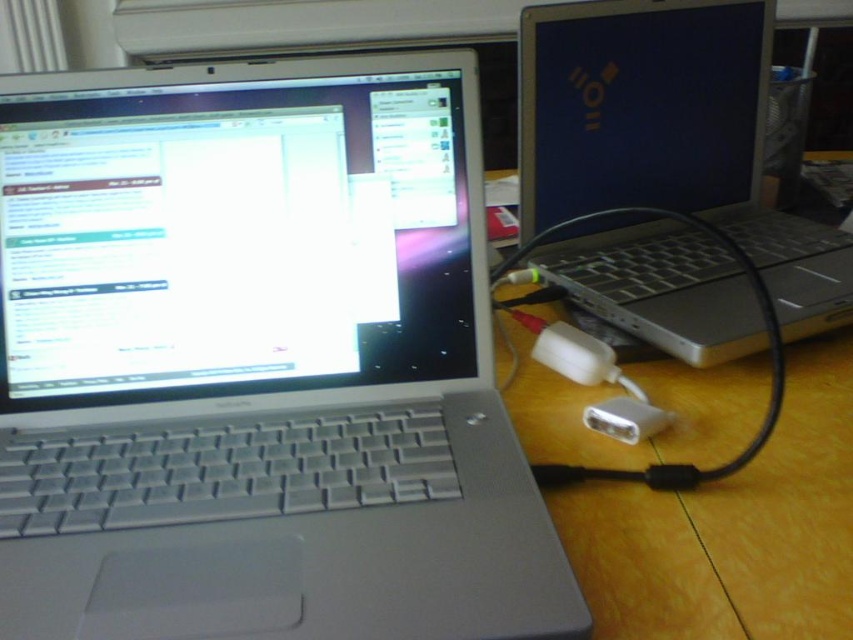
Question: Does silver metallic laptop at left appear under silver metallic laptop at right?

Choices:
 (A) no
 (B) yes

Answer: (B)

Question: Which point appears farthest from the camera in this image?

Choices:
 (A) (399, 317)
 (B) (637, 252)

Answer: (B)

Question: Is silver metallic laptop at left further to camera compared to silver metallic laptop at right?

Choices:
 (A) no
 (B) yes

Answer: (A)

Question: Which point appears farthest from the camera in this image?

Choices:
 (A) (669, 131)
 (B) (459, 468)

Answer: (A)

Question: Can you confirm if silver metallic laptop at left is thinner than silver metallic laptop at right?

Choices:
 (A) no
 (B) yes

Answer: (A)